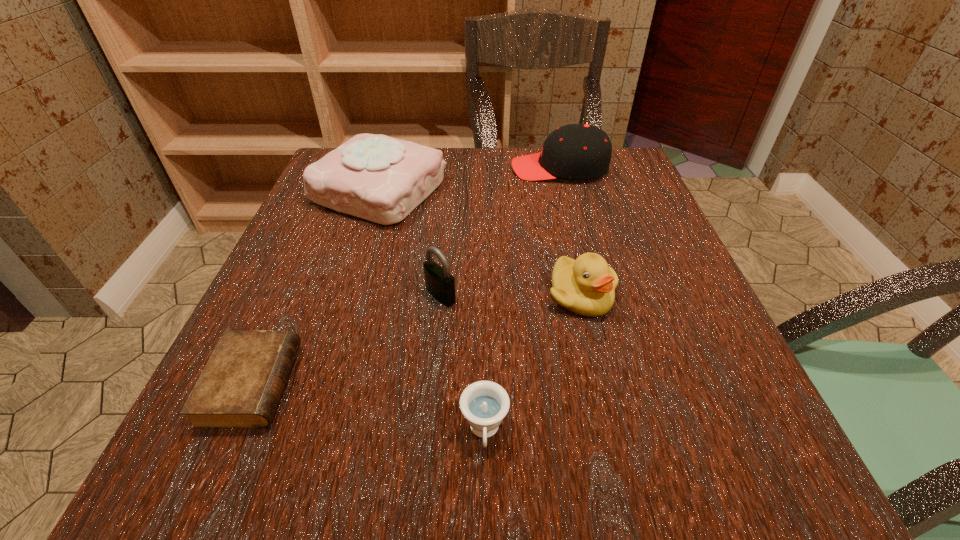
Where is `vacant space that is in between the duckling and the second shortest object`? vacant space that is in between the duckling and the second shortest object is located at coordinates (533, 363).

Find the location of a particular element. The height and width of the screenshot is (540, 960). free space that is in between the cake and the shortest object is located at coordinates (316, 287).

Where is `free space between the cap and the second shortest object`? Image resolution: width=960 pixels, height=540 pixels. free space between the cap and the second shortest object is located at coordinates (522, 300).

The width and height of the screenshot is (960, 540). I want to click on free space between the third object from right to left and the cake, so click(x=432, y=311).

The height and width of the screenshot is (540, 960). I want to click on free space between the duckling and the teacup, so click(533, 363).

Where is `vacant space in between the padlock and the cake`? This screenshot has height=540, width=960. vacant space in between the padlock and the cake is located at coordinates (x=410, y=242).

The height and width of the screenshot is (540, 960). What are the coordinates of `free point between the cap and the cake` in the screenshot? It's located at (469, 179).

You are a GUI agent. You are given a task and a screenshot of the screen. Output one action in this format:
    pyautogui.click(x=<x>, y=<y>)
    Task: Click on the vacant space in between the cap and the duckling
    
    Given the screenshot: What is the action you would take?
    pyautogui.click(x=570, y=232)

I want to click on object that is the third closest to the cap, so click(x=439, y=282).

Identify which object is the third closest to the padlock. Please provide its 2D coordinates. Your answer should be formatted as a tuple, i.e. [(x, y)], where the tuple contains the x and y coordinates of a point satisfying the conditions above.

[(484, 404)]